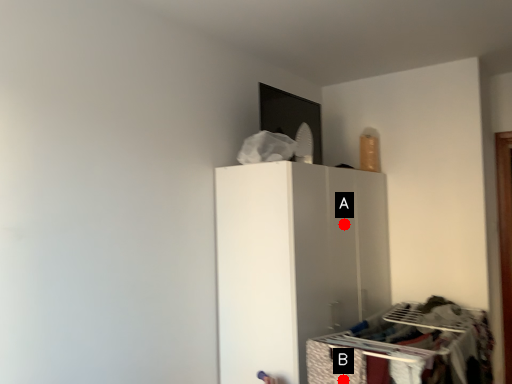
Question: Two points are circled on the image, labeled by A and B beside each circle. Which of the following is the closest to the observer?

Choices:
 (A) A is closer
 (B) B is closer

Answer: (B)